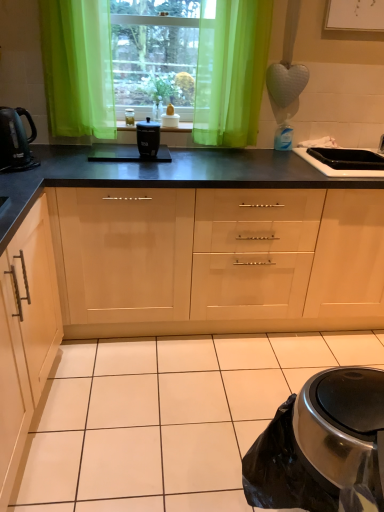
This screenshot has height=512, width=384. I want to click on vacant space underneath green sheer curtain at center (from a real-world perspective), so click(228, 144).